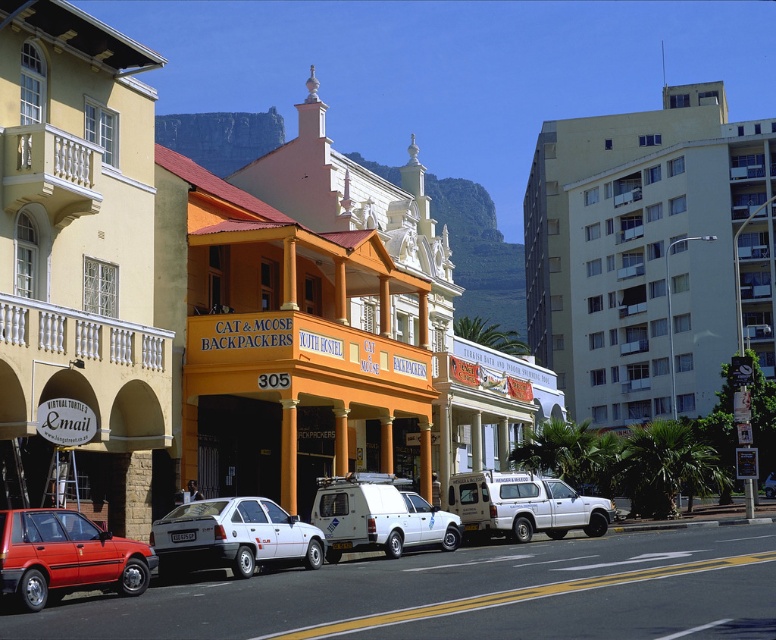
You are a tourist standing in front of the Cat and Moose Backpackers Youth Hostel. You need to park your car between the matte red hatchback at lower left and the white matte car at center. Which parking spot should you choose to be closer to the hostel entrance?

The matte red hatchback at lower left is closer to the viewer than the white matte car at center, so parking between them would place you closer to the hostel entrance near the matte red hatchback at lower left.

You are a delivery driver who needs to park your vehicle between the matte red hatchback at lower left and the white matte car at center. Is there enough space between them to fit your truck, which is 2 meters wide?

The matte red hatchback at lower left is to the left of white matte car at center, but the distance between them is not specified. Without knowing the exact spacing, it is impossible to determine if your 2 meter wide truck can fit between them.

You are a tourist planning to take a photo of the yellow painted building at left from the white matte suv at center. Considering their sizes, which object would appear bigger in your photo?

The yellow painted building at left would appear bigger in the photo because it has a larger size compared to the white matte suv at center.